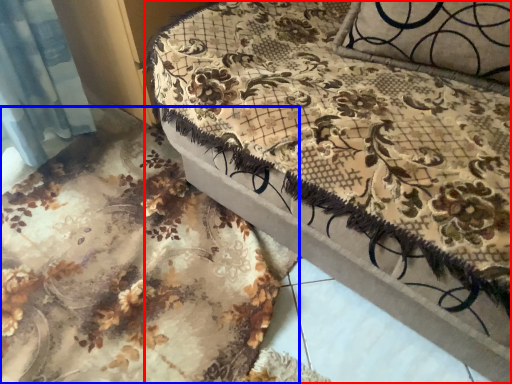
Question: Which of the following is the farthest to the observer, furniture (highlighted by a red box) or bed frame (highlighted by a blue box)?

Choices:
 (A) furniture
 (B) bed frame

Answer: (B)